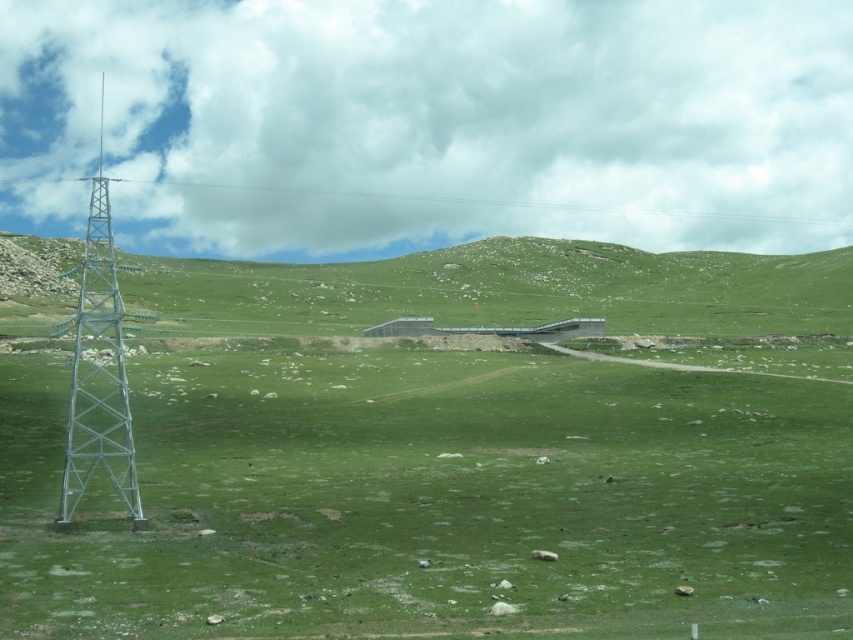
Is the position of green grassy field at center more distant than that of metallic silver tower at left?

That is False.

Does point (844, 593) lie behind point (70, 394)?

No, (844, 593) is closer to viewer.

Does point (3, 467) lie in front of point (137, 512)?

No.

You are a GUI agent. You are given a task and a screenshot of the screen. Output one action in this format:
    pyautogui.click(x=<x>, y=<y>)
    Task: Click on the green grassy field at center
    Image resolution: width=853 pixels, height=640 pixels.
    Given the screenshot: What is the action you would take?
    pyautogui.click(x=434, y=499)

Is green grassy field at center below green grassy hillside at center?

Yes.

Who is more forward, (x=155, y=412) or (x=715, y=276)?

Positioned in front is point (x=155, y=412).

Locate an element on the screen. green grassy field at center is located at coordinates (434, 499).

Which is behind, point (505, 253) or point (64, 451)?

Positioned behind is point (505, 253).

Between green grassy hillside at center and metallic silver tower at left, which one has more height?

Standing taller between the two is metallic silver tower at left.

Describe the element at coordinates (506, 289) in the screenshot. The width and height of the screenshot is (853, 640). I see `green grassy hillside at center` at that location.

At what (x,y) coordinates should I click in order to perform the action: click on green grassy hillside at center. Please return your answer as a coordinate pair (x, y). This screenshot has height=640, width=853. Looking at the image, I should click on (506, 289).